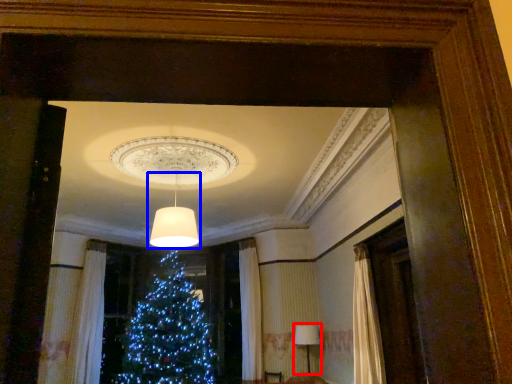
Question: Among these objects, which one is nearest to the camera, lamp (highlighted by a red box) or lamp (highlighted by a blue box)?

Choices:
 (A) lamp
 (B) lamp

Answer: (B)